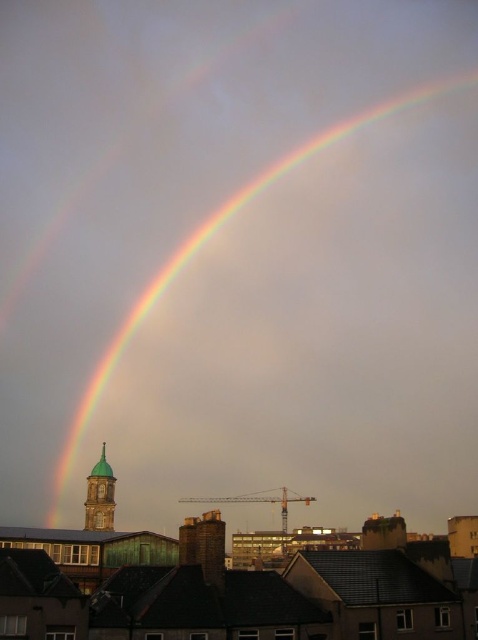
Question: Is rainbow at upper center thinner than green matte bell tower at center?

Choices:
 (A) no
 (B) yes

Answer: (A)

Question: Which of the following is the closest to the observer?

Choices:
 (A) (73, 451)
 (B) (98, 515)

Answer: (B)

Question: Where is rainbow at upper center located in relation to green matte bell tower at center in the image?

Choices:
 (A) right
 (B) left

Answer: (A)

Question: Does rainbow at upper center have a lesser width compared to green matte bell tower at center?

Choices:
 (A) no
 (B) yes

Answer: (A)